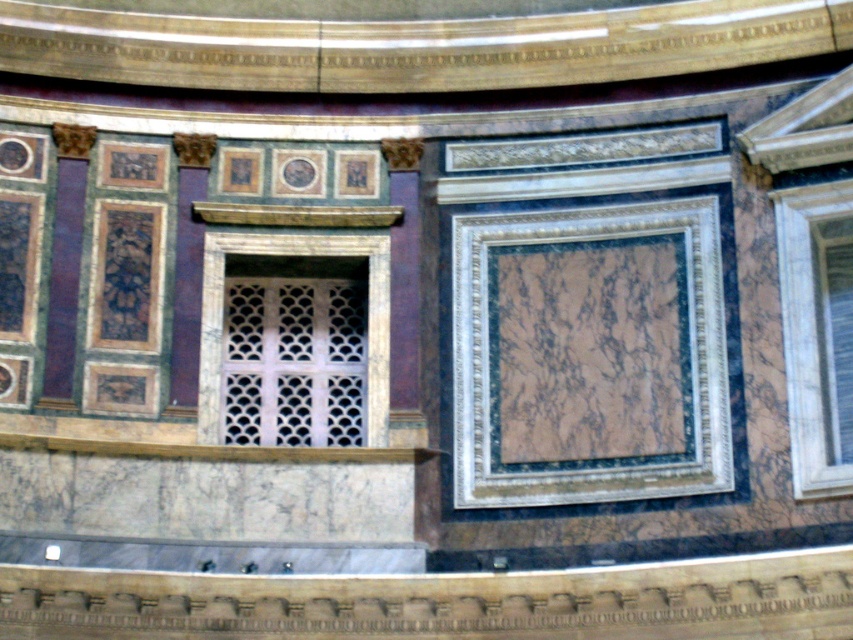
Question: Does marble at center appear over white marble window at right?

Choices:
 (A) no
 (B) yes

Answer: (B)

Question: Which is nearer to the white marble window at center?

Choices:
 (A) marble at center
 (B) white marble window at right

Answer: (A)

Question: Which point is farther to the camera?

Choices:
 (A) (822, 195)
 (B) (212, 355)

Answer: (B)

Question: Which object is farther from the camera taking this photo?

Choices:
 (A) white marble window at right
 (B) white marble window at center
 (C) marble at center

Answer: (B)

Question: Considering the relative positions of marble at center and white marble window at right in the image provided, where is marble at center located with respect to white marble window at right?

Choices:
 (A) above
 (B) below

Answer: (A)

Question: Can you confirm if white marble window at right is bigger than white marble window at center?

Choices:
 (A) no
 (B) yes

Answer: (A)